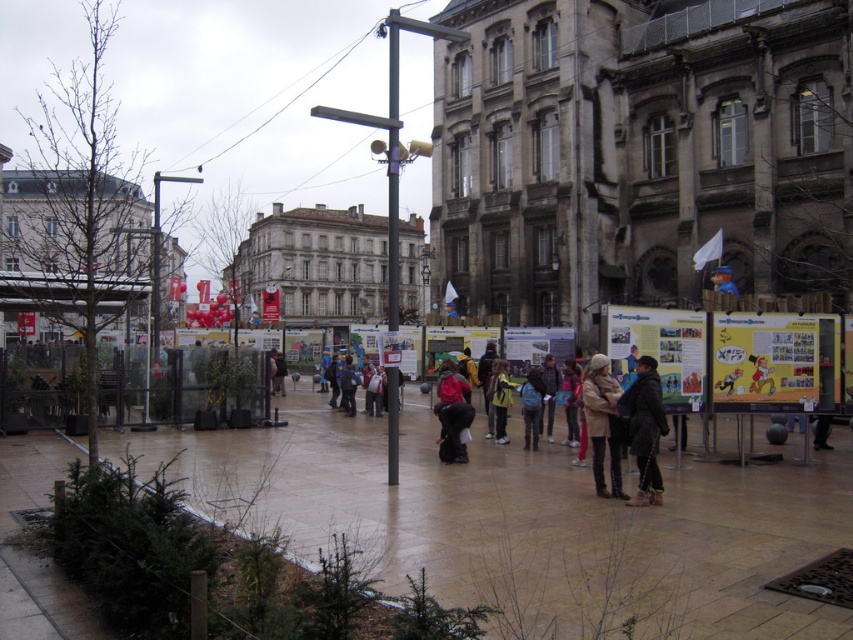
Does matte black jacket at center have a greater width compared to blue fabric backpack at center?

No, matte black jacket at center is not wider than blue fabric backpack at center.

Between point (439, 448) and point (538, 436), which one is positioned behind?

Positioned behind is point (538, 436).

Measure the distance between point (438, 406) and camera.

Point (438, 406) and camera are 28.88 meters apart from each other.

You are a GUI agent. You are given a task and a screenshot of the screen. Output one action in this format:
    pyautogui.click(x=<x>, y=<y>)
    Task: Click on the matte black jacket at center
    
    Given the screenshot: What is the action you would take?
    pyautogui.click(x=451, y=429)

Based on the photo, which of these two, brown stone pavement at lower center or black textured coat at center, stands shorter?

With less height is brown stone pavement at lower center.

You are a GUI agent. You are given a task and a screenshot of the screen. Output one action in this format:
    pyautogui.click(x=<x>, y=<y>)
    Task: Click on the brown stone pavement at lower center
    The image size is (853, 640).
    Given the screenshot: What is the action you would take?
    pyautogui.click(x=531, y=522)

Does black textured coat at center appear on the right side of tan leather jacket at center?

Correct, you'll find black textured coat at center to the right of tan leather jacket at center.

Does black textured coat at center have a lesser width compared to tan leather jacket at center?

Correct, black textured coat at center's width is less than tan leather jacket at center's.

The image size is (853, 640). Describe the element at coordinates (645, 428) in the screenshot. I see `black textured coat at center` at that location.

Locate an element on the screen. The image size is (853, 640). black textured coat at center is located at coordinates (645, 428).